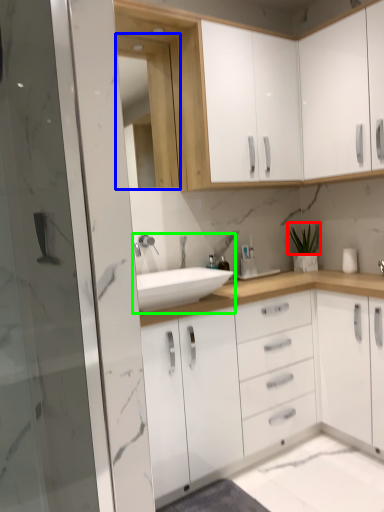
Question: Which is nearer to the plant (highlighted by a red box)? medicine cabinet (highlighted by a blue box) or sink (highlighted by a green box).

Choices:
 (A) medicine cabinet
 (B) sink

Answer: (B)